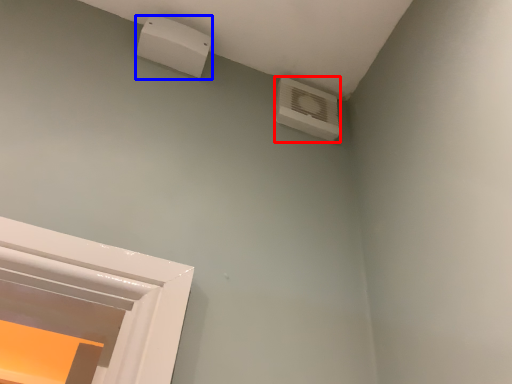
Question: Which point is further to the camera, air conditioning (highlighted by a red box) or electric outlet (highlighted by a blue box)?

Choices:
 (A) air conditioning
 (B) electric outlet

Answer: (A)